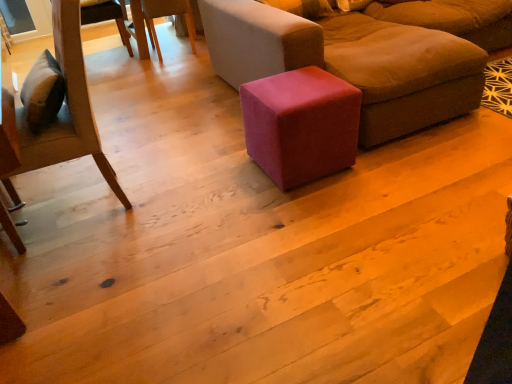
Question: Can you confirm if wooden chair at left, positioned as the second chair in top-to-bottom order, is positioned to the left of velvet brown ottoman at center?

Choices:
 (A) no
 (B) yes

Answer: (B)

Question: From the image's perspective, does wooden chair at left, which appears as the 1th chair when viewed from the front, appear lower than velvet brown ottoman at center?

Choices:
 (A) no
 (B) yes

Answer: (B)

Question: Is wooden chair at left, positioned as the second chair in top-to-bottom order, outside of velvet brown ottoman at center?

Choices:
 (A) yes
 (B) no

Answer: (A)

Question: Is wooden chair at left, which appears as the 1th chair when viewed from the front, positioned with its back to velvet brown ottoman at center?

Choices:
 (A) yes
 (B) no

Answer: (A)

Question: Is wooden chair at left, which is the first chair from bottom to top, in contact with velvet brown ottoman at center?

Choices:
 (A) no
 (B) yes

Answer: (A)

Question: Is velvet pink cube at center wider or thinner than wooden chair at upper left, the 1th chair positioned from the back?

Choices:
 (A) thin
 (B) wide

Answer: (A)

Question: From a real-world perspective, is velvet pink cube at center physically located above or below wooden chair at upper left, marked as the second chair in a front-to-back arrangement?

Choices:
 (A) below
 (B) above

Answer: (A)

Question: Considering the positions of velvet pink cube at center and wooden chair at upper left, placed as the 2th chair when sorted from bottom to top, in the image, is velvet pink cube at center taller or shorter than wooden chair at upper left, placed as the 2th chair when sorted from bottom to top,?

Choices:
 (A) tall
 (B) short

Answer: (B)

Question: Do you think velvet pink cube at center is within wooden chair at upper left, the 1th chair positioned from the top, or outside of it?

Choices:
 (A) outside
 (B) inside

Answer: (A)

Question: From the image's perspective, is velvet pink cube at center above or below wooden chair at left, which appears as the 1th chair when viewed from the front?

Choices:
 (A) below
 (B) above

Answer: (B)

Question: Is velvet pink cube at center in front of or behind wooden chair at left, which is the first chair from bottom to top, in the image?

Choices:
 (A) front
 (B) behind

Answer: (B)

Question: Does point (x=331, y=110) appear closer or farther from the camera than point (x=74, y=157)?

Choices:
 (A) farther
 (B) closer

Answer: (B)

Question: In the image, is velvet pink cube at center on the left side or the right side of wooden chair at left, positioned as the second chair in top-to-bottom order?

Choices:
 (A) left
 (B) right

Answer: (B)

Question: From their relative heights in the image, would you say wooden chair at upper left, the 1th chair positioned from the top, is taller or shorter than velvet pink cube at center?

Choices:
 (A) tall
 (B) short

Answer: (A)

Question: Looking at their shapes, would you say wooden chair at upper left, the 1th chair positioned from the back, is wider or thinner than velvet pink cube at center?

Choices:
 (A) wide
 (B) thin

Answer: (A)